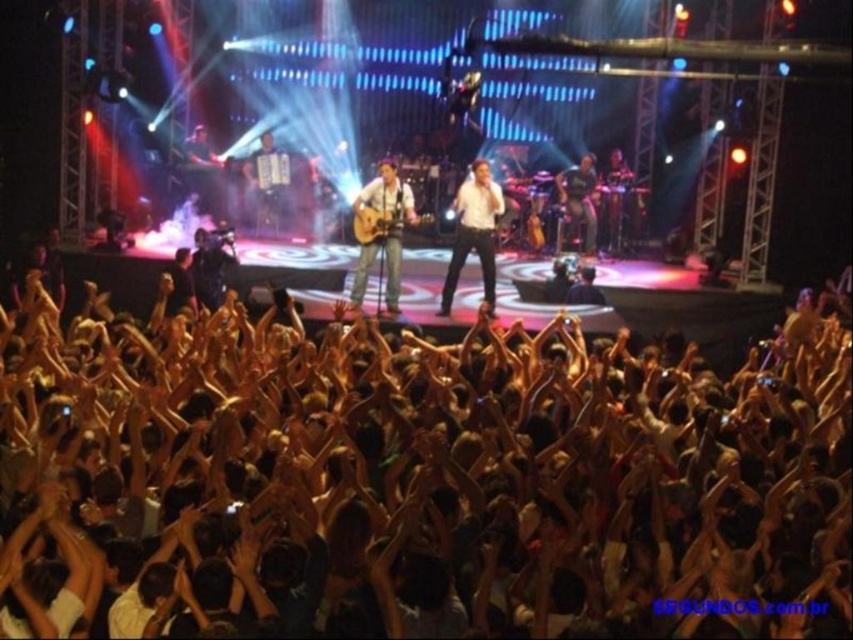
You are a stagehand responsible for setting up the next act. You need to move both the matte brown acoustic guitar at center and the acoustic wood guitar at center off the stage. Which guitar should you move first if you want to clear more space on the stage faster?

The acoustic wood guitar at center should be moved first because it occupies more space than the matte brown acoustic guitar at center, allowing for quicker clearance of the stage.